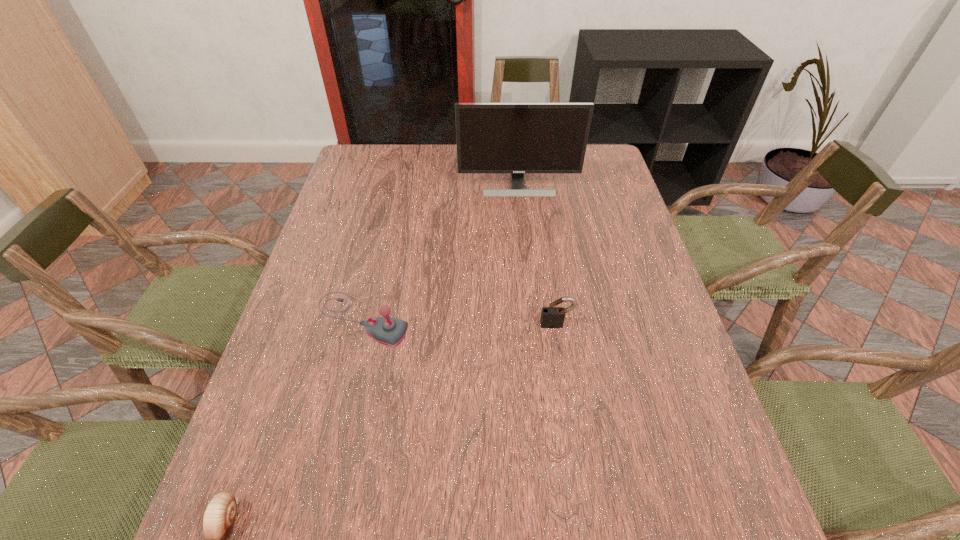
You are a GUI agent. You are given a task and a screenshot of the screen. Output one action in this format:
    pyautogui.click(x=<x>, y=<y>)
    Task: Click on the tallest object
    The width and height of the screenshot is (960, 540).
    Given the screenshot: What is the action you would take?
    pyautogui.click(x=517, y=138)

Locate an element on the screen. The height and width of the screenshot is (540, 960). the farthest object is located at coordinates (517, 138).

Where is `the second object from left to right`? The width and height of the screenshot is (960, 540). the second object from left to right is located at coordinates (387, 330).

Find the location of `padlock`. padlock is located at coordinates (552, 317).

Where is `vacant space situated 0.290m on the screen side of the tallest object`? Image resolution: width=960 pixels, height=540 pixels. vacant space situated 0.290m on the screen side of the tallest object is located at coordinates (526, 259).

Where is `free spot located on the front of the joystick`? The height and width of the screenshot is (540, 960). free spot located on the front of the joystick is located at coordinates (310, 539).

I want to click on vacant space located with the keyhole on the front of the padlock, so click(574, 445).

Identify the location of object that is at the far edge. (517, 138).

You are a GUI agent. You are given a task and a screenshot of the screen. Output one action in this format:
    pyautogui.click(x=<x>, y=<y>)
    Task: Click on the object present at the left edge
    The image size is (960, 540).
    Given the screenshot: What is the action you would take?
    pyautogui.click(x=387, y=330)

In order to click on object that is positioned at the right edge in this screenshot , I will do `click(517, 138)`.